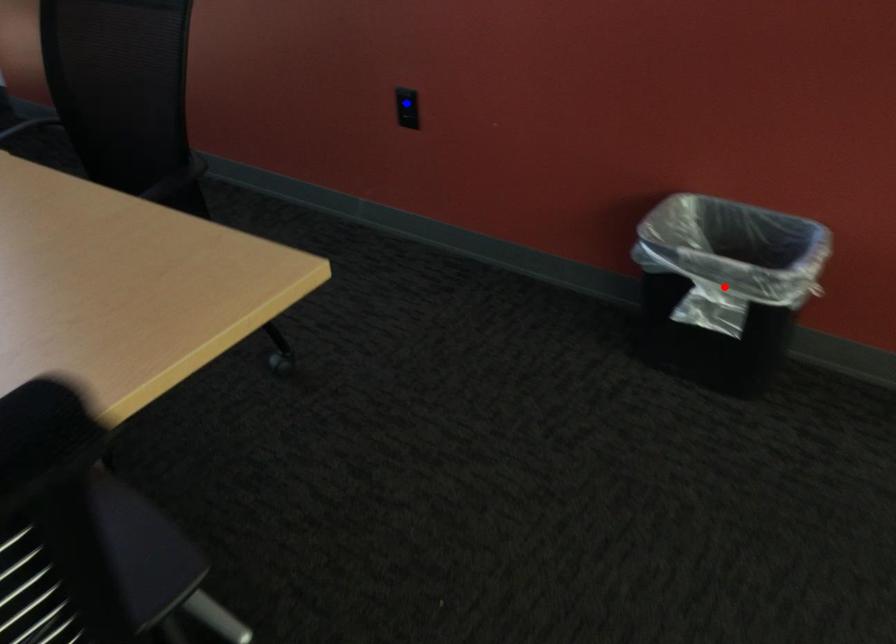
Question: Two points are marked on the image. Which point is closer to the camera?

Choices:
 (A) Blue point is closer.
 (B) Red point is closer.

Answer: (B)